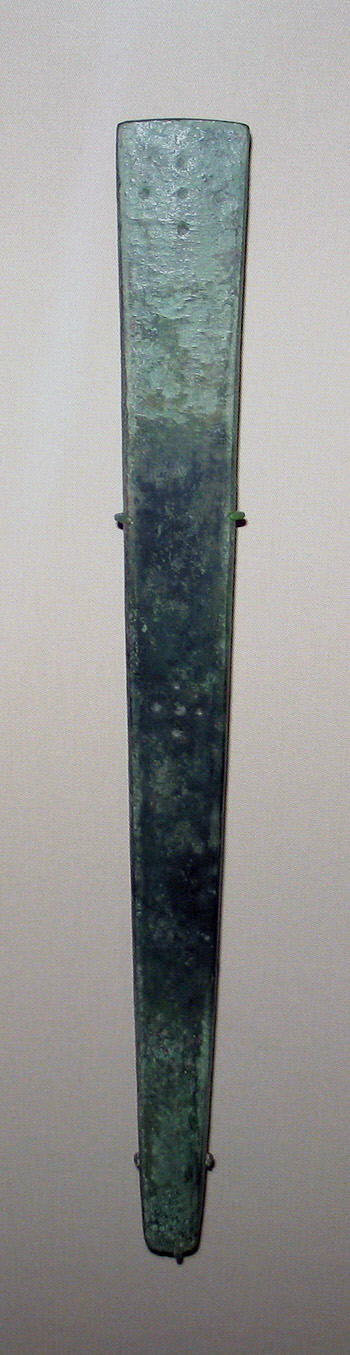
Locate an element on the screen. wall to left of art piece is located at coordinates (62, 686).